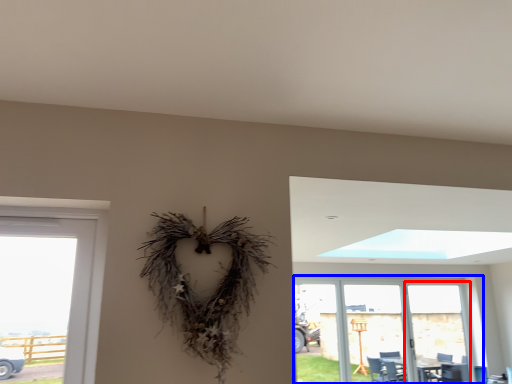
Question: Which object appears farthest to the camera in this image, screen door (highlighted by a red box) or window (highlighted by a blue box)?

Choices:
 (A) screen door
 (B) window

Answer: (A)